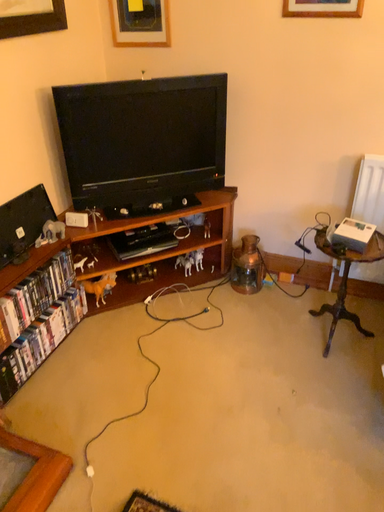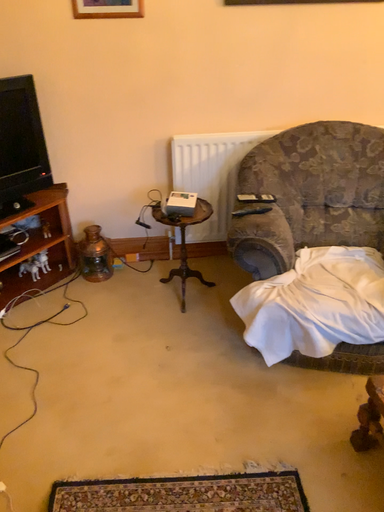
Question: Which way did the camera rotate in the video?

Choices:
 (A) rotated left
 (B) rotated right

Answer: (B)